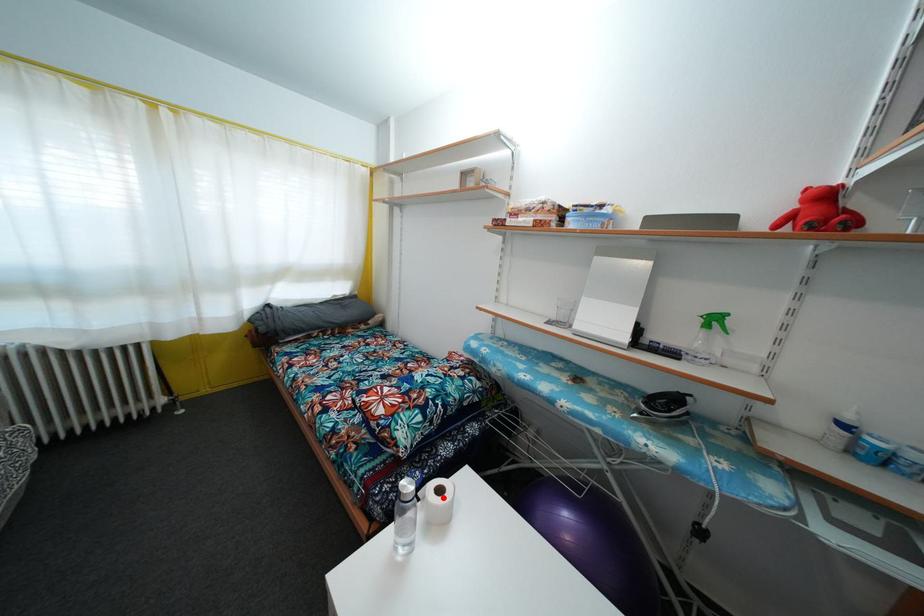
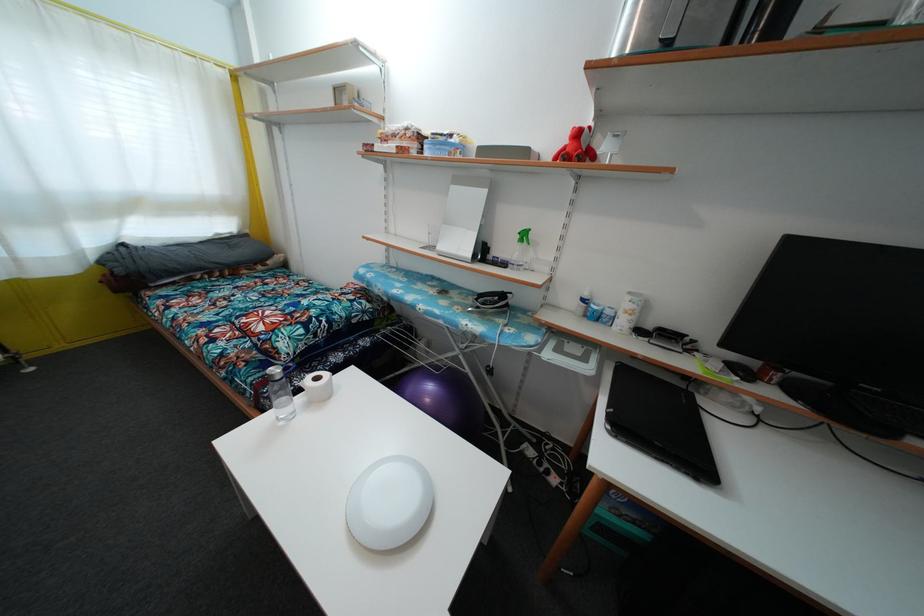
The point at the highlighted location is marked in the first image. Where is the corresponding point in the second image?

(321, 386)